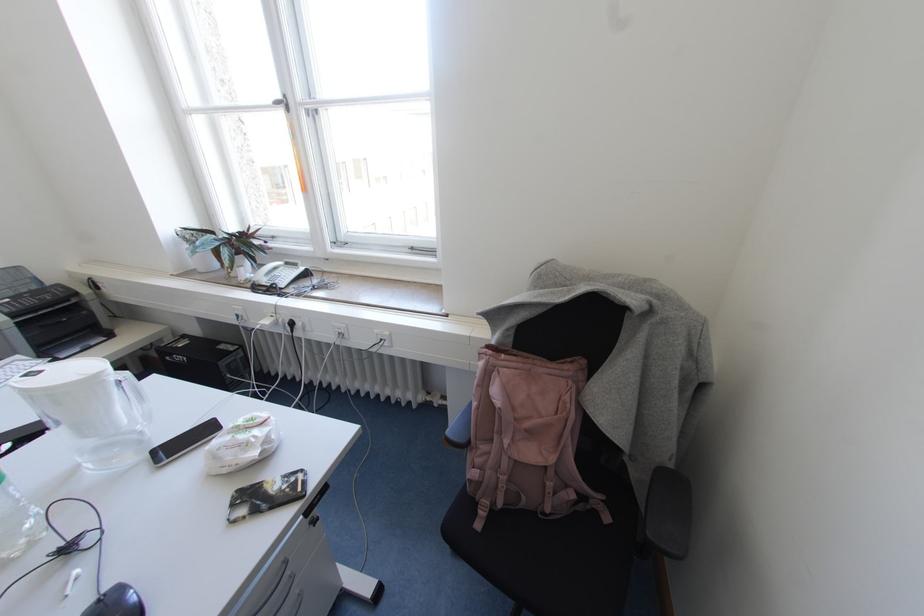
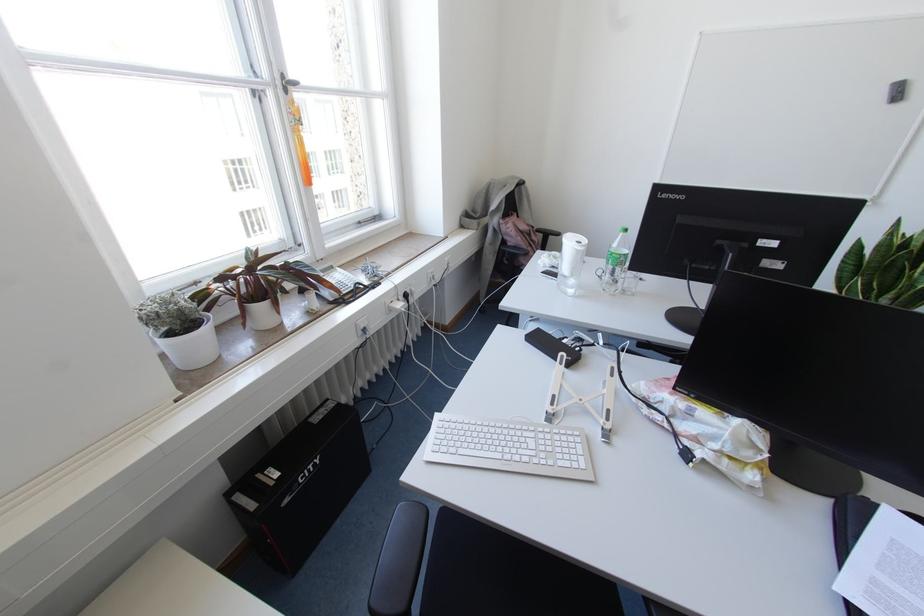
Find the pixel in the second image that matches [301,268] in the first image.

(336, 268)